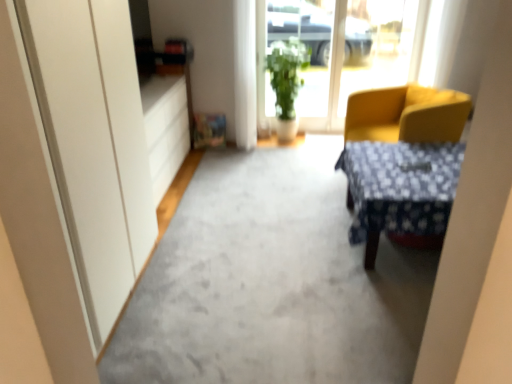
Question: From a real-world perspective, does gray carpet at center stand above yellow fabric chair at right?

Choices:
 (A) no
 (B) yes

Answer: (A)

Question: Could you tell me if gray carpet at center is turned towards yellow fabric chair at right?

Choices:
 (A) no
 (B) yes

Answer: (A)

Question: Can you see gray carpet at center touching yellow fabric chair at right?

Choices:
 (A) yes
 (B) no

Answer: (B)

Question: Is gray carpet at center thinner than yellow fabric chair at right?

Choices:
 (A) yes
 (B) no

Answer: (B)

Question: Would you say gray carpet at center is a long distance from yellow fabric chair at right?

Choices:
 (A) no
 (B) yes

Answer: (B)

Question: From a real-world perspective, is gray carpet at center below yellow fabric chair at right?

Choices:
 (A) yes
 (B) no

Answer: (A)

Question: Is green leafy plant at center positioned with its back to gray carpet at center?

Choices:
 (A) no
 (B) yes

Answer: (A)

Question: Can you see green leafy plant at center touching gray carpet at center?

Choices:
 (A) no
 (B) yes

Answer: (A)

Question: Is green leafy plant at center smaller than gray carpet at center?

Choices:
 (A) no
 (B) yes

Answer: (A)

Question: Considering the relative sizes of green leafy plant at center and gray carpet at center in the image provided, is green leafy plant at center bigger than gray carpet at center?

Choices:
 (A) yes
 (B) no

Answer: (A)

Question: Could gray carpet at center be considered to be inside green leafy plant at center?

Choices:
 (A) no
 (B) yes

Answer: (A)

Question: Is the depth of green leafy plant at center less than that of gray carpet at center?

Choices:
 (A) yes
 (B) no

Answer: (B)

Question: From the image's perspective, is green leafy plant at center above transparent glass window at center?

Choices:
 (A) no
 (B) yes

Answer: (A)